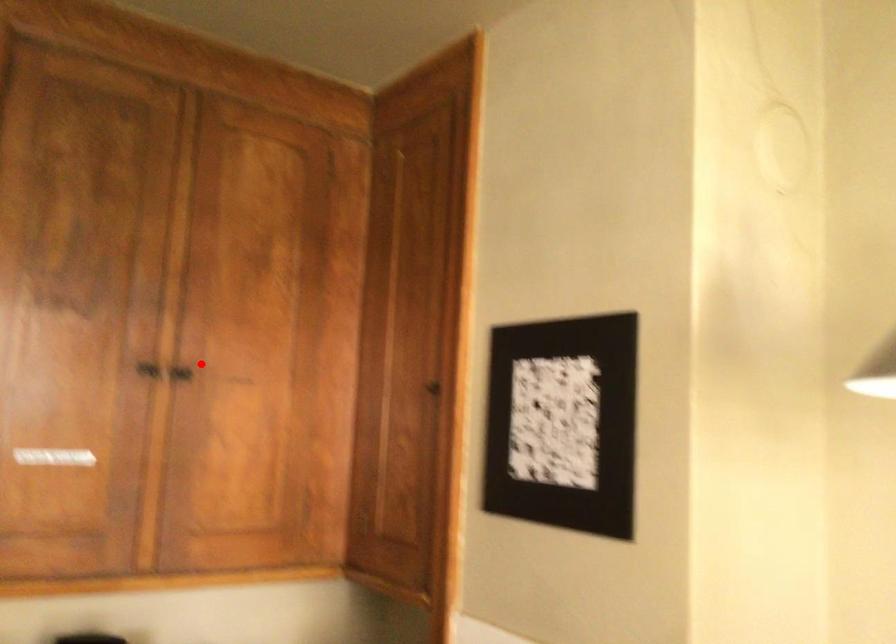
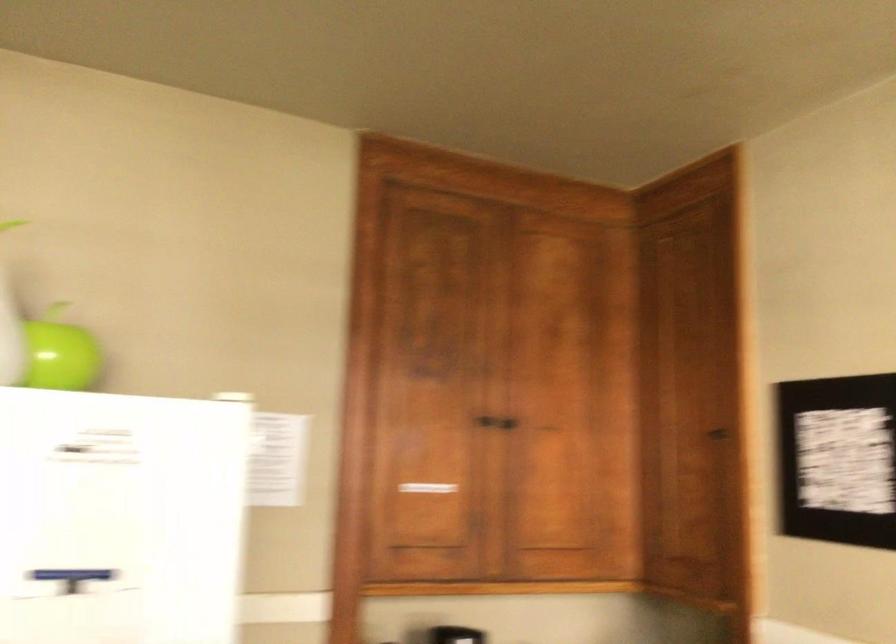
The point at the highlighted location is marked in the first image. Where is the corresponding point in the second image?

(511, 419)